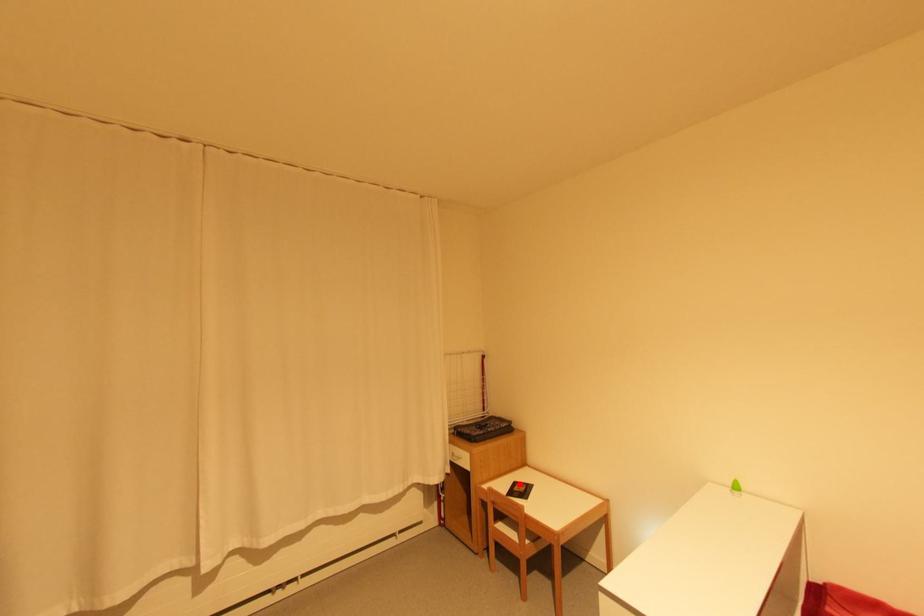
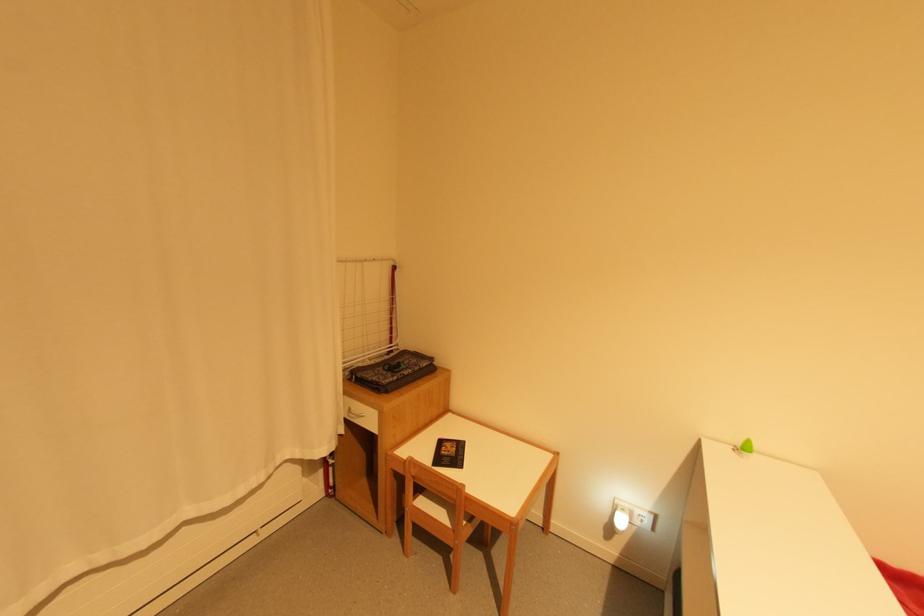
The point at the highlighted location is marked in the first image. Where is the corresponding point in the second image?

(445, 443)